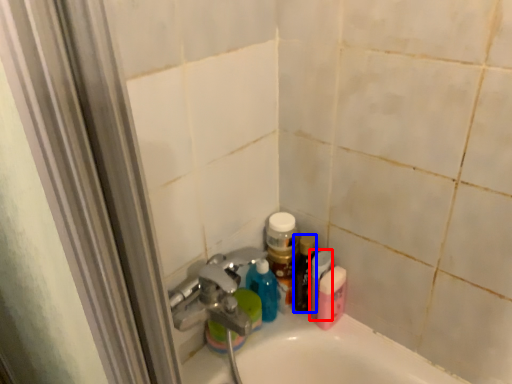
Question: Among these objects, which one is nearest to the camera, mouthwash (highlighted by a red box) or toiletry (highlighted by a blue box)?

Choices:
 (A) mouthwash
 (B) toiletry

Answer: (A)